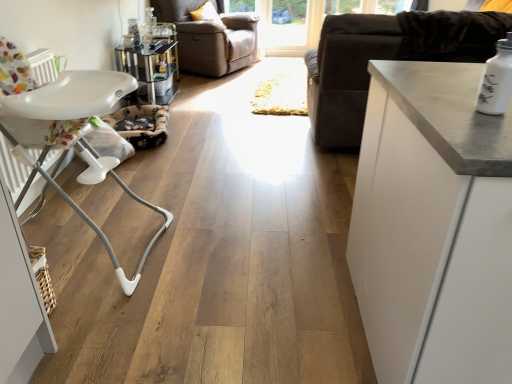
The image size is (512, 384). I want to click on free location to the right of white plastic highchair at left, so 207,275.